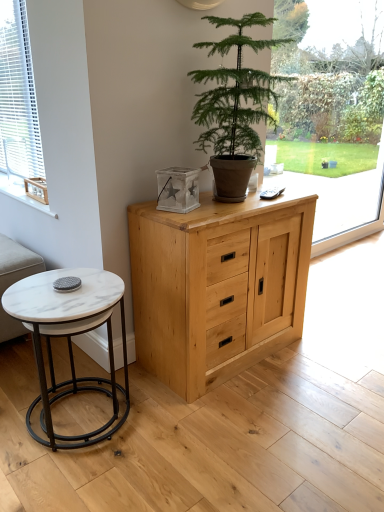
Question: From the image's perspective, is beige fabric couch at lower left positioned above or below green leafy plant at center?

Choices:
 (A) above
 (B) below

Answer: (B)

Question: Which is correct: beige fabric couch at lower left is inside green leafy plant at center, or outside of it?

Choices:
 (A) outside
 (B) inside

Answer: (A)

Question: Which object is the farthest from the white marble coffee table at lower left?

Choices:
 (A) green leafy plant at center
 (B) white blinds at left
 (C) beige fabric couch at lower left
 (D) natural wood cabinet at center
 (E) wooden crate at left

Answer: (B)

Question: Which is farther from the green leafy plant at center?

Choices:
 (A) beige fabric couch at lower left
 (B) white marble coffee table at lower left
 (C) transparent glass window at center
 (D) natural wood cabinet at center
 (E) white blinds at left

Answer: (A)